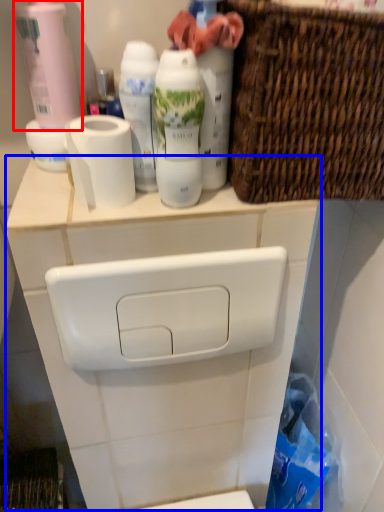
Question: Which point is further to the camera, cleaning product (highlighted by a red box) or counter (highlighted by a blue box)?

Choices:
 (A) cleaning product
 (B) counter

Answer: (B)